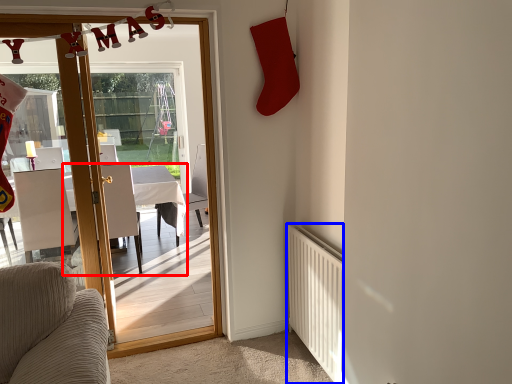
Question: Which point is closer to the camera, table (highlighted by a red box) or radiator (highlighted by a blue box)?

Choices:
 (A) table
 (B) radiator

Answer: (B)